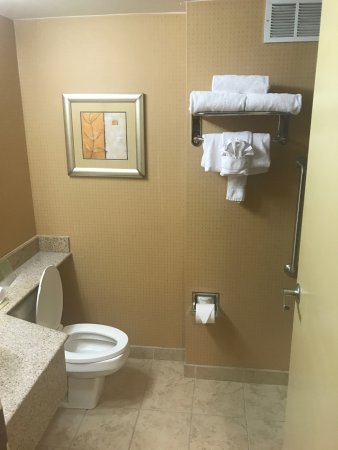
Where is `sink`? The height and width of the screenshot is (450, 338). sink is located at coordinates (5, 432).